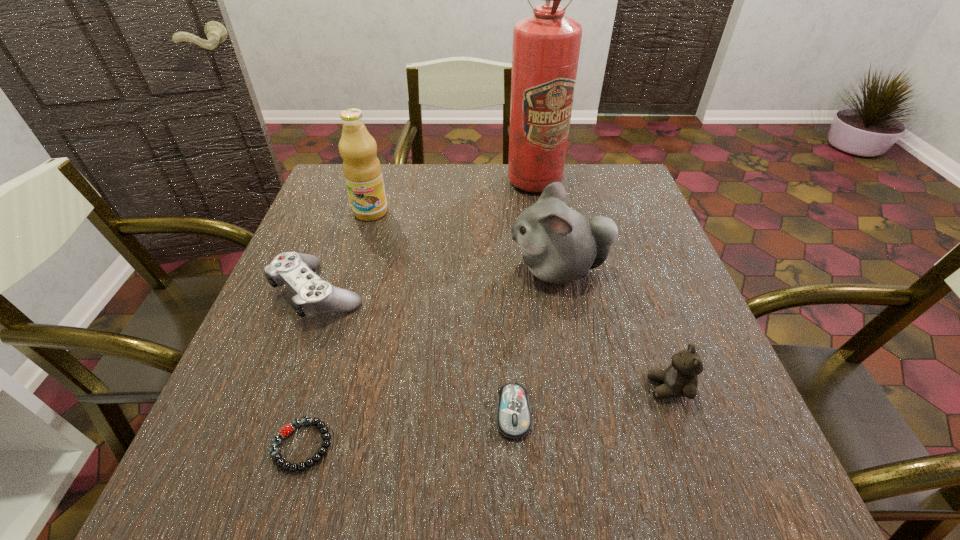
Identify the location of object that is at the near left corner. The height and width of the screenshot is (540, 960). (324, 430).

Image resolution: width=960 pixels, height=540 pixels. Find the location of `free space at the far edge of the desktop`. free space at the far edge of the desktop is located at coordinates (476, 177).

The width and height of the screenshot is (960, 540). In the image, there is a desktop. In order to click on vacant space at the near edge in this screenshot , I will do `click(594, 476)`.

The width and height of the screenshot is (960, 540). In the image, there is a desktop. What are the coordinates of `vacant space at the left edge` in the screenshot? It's located at (248, 424).

In the image, there is a desktop. Identify the location of vacant space at the right edge. (645, 343).

Image resolution: width=960 pixels, height=540 pixels. What are the coordinates of `free point at the far right corner` in the screenshot? It's located at (621, 198).

In the image, there is a desktop. Identify the location of vacant space at the near right corner. (764, 492).

This screenshot has height=540, width=960. Find the location of `empty space that is in between the tallest object and the rightmost object`. empty space that is in between the tallest object and the rightmost object is located at coordinates (601, 285).

This screenshot has width=960, height=540. I want to click on vacant area that lies between the rightmost object and the fifth tallest object, so click(x=493, y=340).

At what (x,y) coordinates should I click in order to perform the action: click on vacant area that lies between the hamster and the sixth shortest object. Please return your answer as a coordinate pair (x, y). Looking at the image, I should click on (465, 241).